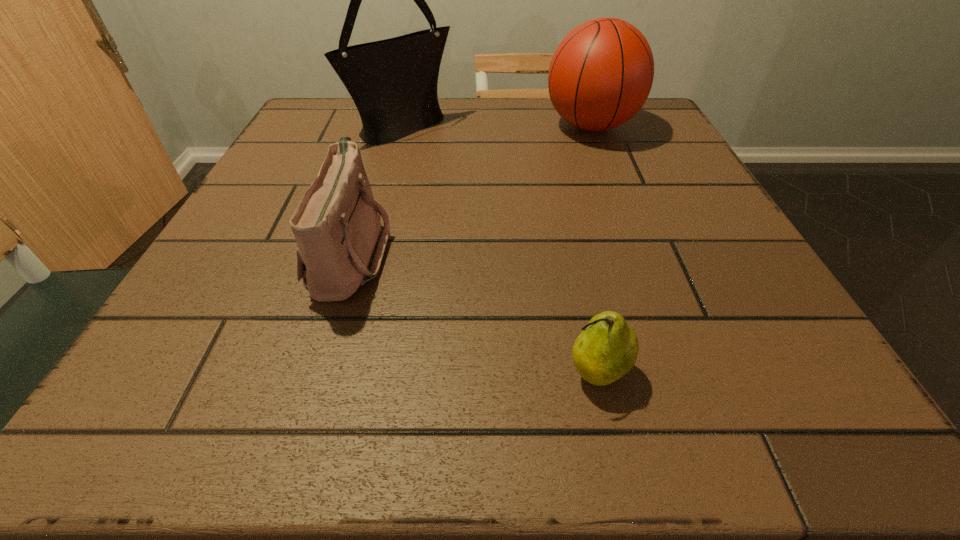
Identify the location of free space between the tallest object and the nearer shoulder bag. Image resolution: width=960 pixels, height=540 pixels. (377, 190).

The image size is (960, 540). Identify the location of vacant region between the nearest object and the second tallest object. click(x=594, y=249).

Locate which object ranks in proximity to the third farthest object. Please provide its 2D coordinates. Your answer should be formatted as a tuple, i.e. [(x, y)], where the tuple contains the x and y coordinates of a point satisfying the conditions above.

[(393, 82)]

The height and width of the screenshot is (540, 960). I want to click on object that can be found as the third closest to the tallest object, so click(x=607, y=349).

The height and width of the screenshot is (540, 960). I want to click on vacant space that satisfies the following two spatial constraints: 1. on the front pocket of the shorter shoulder bag; 2. on the right side of the pear, so click(x=314, y=372).

This screenshot has height=540, width=960. Identify the location of free region that satisfies the following two spatial constraints: 1. on the back side of the shortest object; 2. on the front pocket of the shorter shoulder bag. (571, 252).